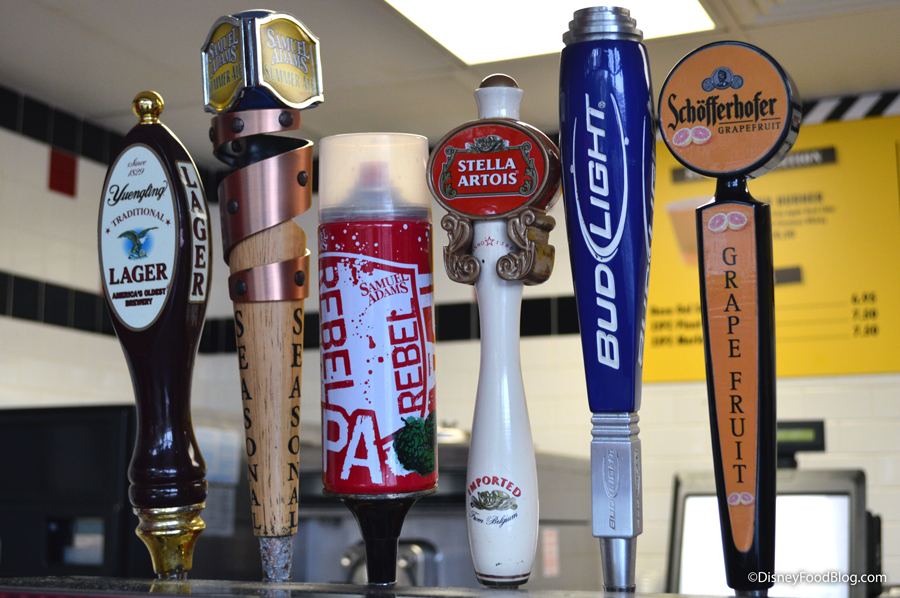
Locate an element on the screen. tap handles is located at coordinates (136, 228), (263, 196), (364, 269), (508, 310), (621, 248), (740, 291).